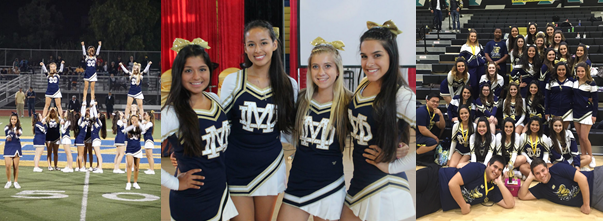
This screenshot has width=603, height=221. In order to click on gymnasium floor in this screenshot , I will do `click(482, 213)`, `click(541, 210)`.